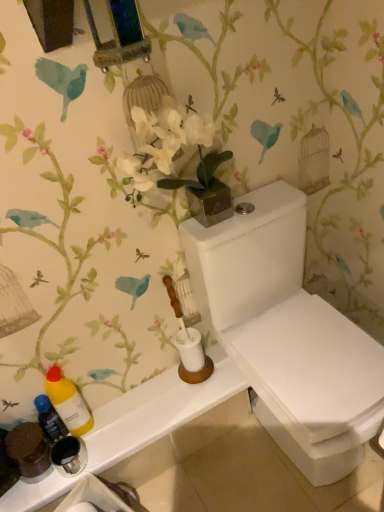
Question: From a real-world perspective, is white ceramic toilet brush at center positioned above or below white glossy counter top at lower left?

Choices:
 (A) below
 (B) above

Answer: (B)

Question: Do you think white ceramic toilet brush at center is within white glossy counter top at lower left, or outside of it?

Choices:
 (A) inside
 (B) outside

Answer: (B)

Question: Estimate the real-world distances between objects in this image. Which object is farther from the yellow matte bottle at lower left, the 1th bottle from the right?

Choices:
 (A) translucent plastic bottle at lower left, positioned as the 1th bottle in left-to-right order
 (B) white glossy toilet at center
 (C) white ceramic toilet brush at center
 (D) white glossy counter top at lower left

Answer: (B)

Question: Which object is the closest to the white glossy toilet at center?

Choices:
 (A) translucent plastic bottle at lower left, which is counted as the second bottle, starting from the right
 (B) white glossy counter top at lower left
 (C) white ceramic toilet brush at center
 (D) yellow matte bottle at lower left, the 1th bottle from the right

Answer: (C)